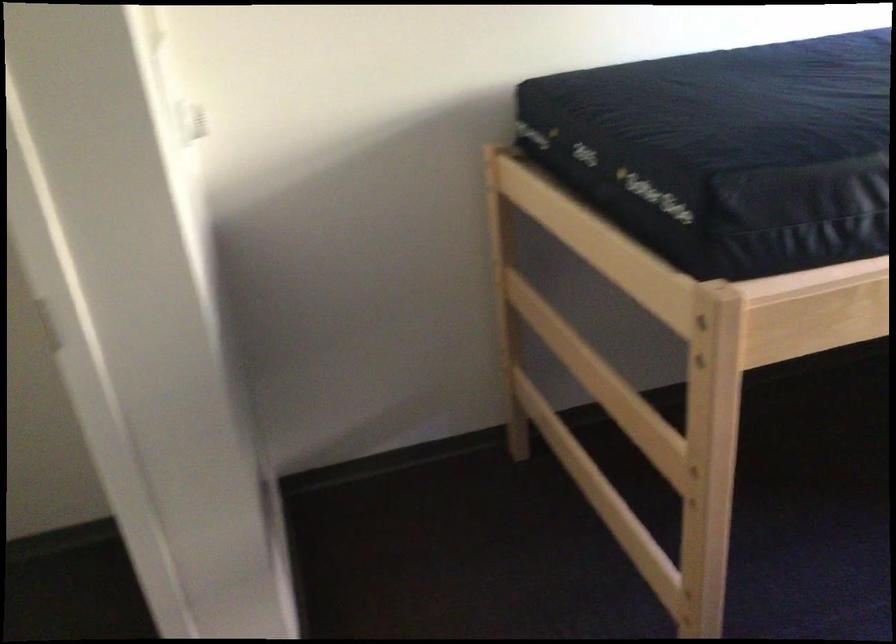
You are a GUI agent. You are given a task and a screenshot of the screen. Output one action in this format:
    pyautogui.click(x=<x>, y=<y>)
    Task: Click on the bed sitting surface
    The width and height of the screenshot is (896, 644).
    Given the screenshot: What is the action you would take?
    pyautogui.click(x=753, y=108)